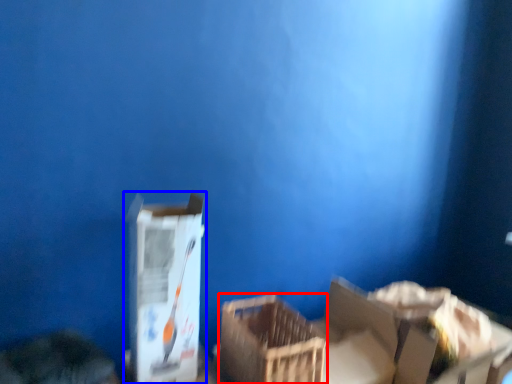
Question: Which of the following is the closest to the observer, crate (highlighted by a red box) or box (highlighted by a blue box)?

Choices:
 (A) crate
 (B) box

Answer: (B)